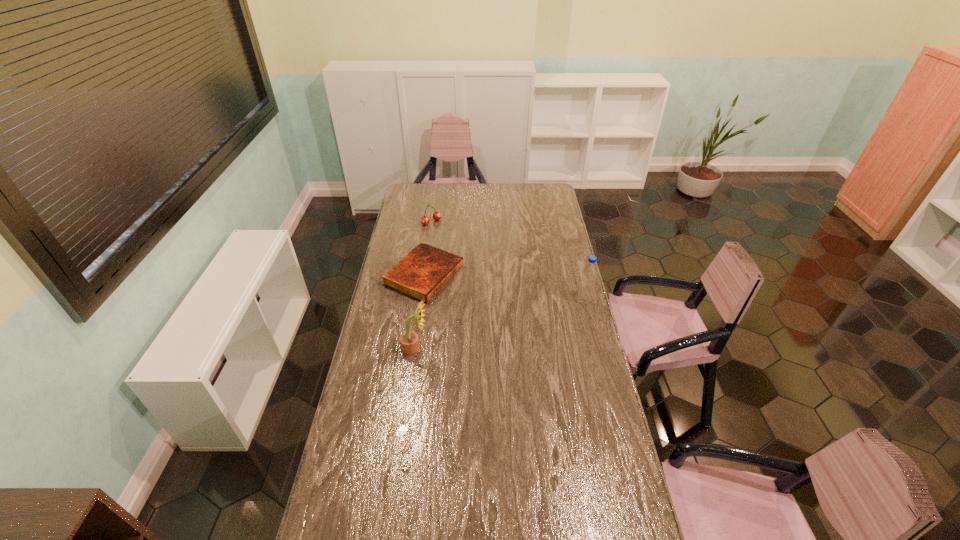
Where is `free space on the desktop that is between the sunflower and the water bottle and is positioned on the spine side of the Bible`? The height and width of the screenshot is (540, 960). free space on the desktop that is between the sunflower and the water bottle and is positioned on the spine side of the Bible is located at coordinates 528,317.

You are a GUI agent. You are given a task and a screenshot of the screen. Output one action in this format:
    pyautogui.click(x=<x>, y=<y>)
    Task: Click on the free spot on the desktop that is between the nearest object and the rightmost object and is positioned with stems pointing upwards on the farthest object
    The height and width of the screenshot is (540, 960).
    Given the screenshot: What is the action you would take?
    pyautogui.click(x=529, y=316)